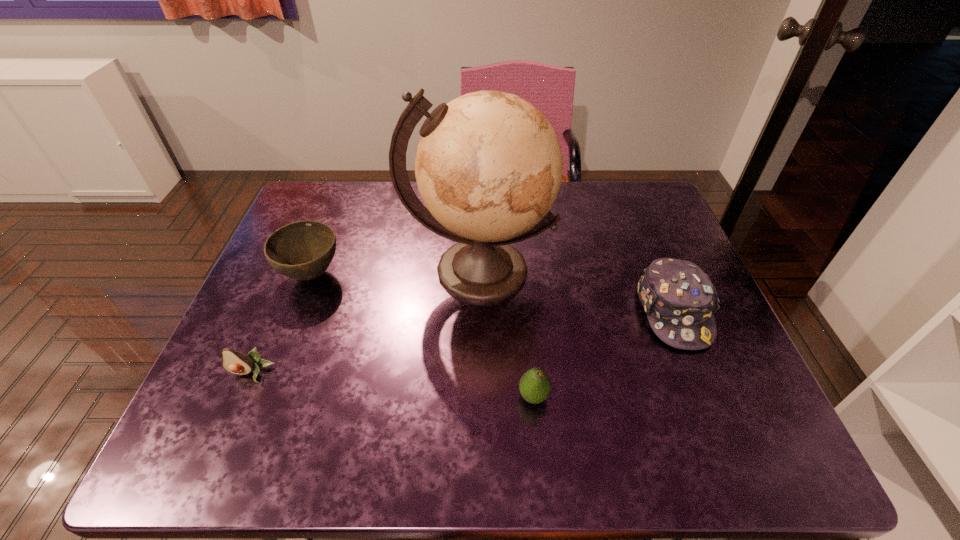
This screenshot has width=960, height=540. I want to click on free space located on the seed side of the left avocado, so click(222, 444).

Identify the location of vacant space located on the right of the right avocado. (696, 396).

Find the location of `bowl located in the left edge section of the desktop`. bowl located in the left edge section of the desktop is located at coordinates (303, 250).

What are the coordinates of `avocado located in the left edge section of the desktop` in the screenshot? It's located at (236, 362).

At what (x,y) coordinates should I click in order to perform the action: click on object at the right edge. Please return your answer as a coordinate pair (x, y). Looking at the image, I should click on (680, 300).

The height and width of the screenshot is (540, 960). In order to click on free space at the far edge of the desktop in this screenshot , I will do `click(559, 196)`.

This screenshot has width=960, height=540. I want to click on vacant space at the near edge, so click(356, 430).

Locate an element on the screen. The width and height of the screenshot is (960, 540). free region at the left edge of the desktop is located at coordinates (252, 327).

Where is `free region at the right edge`? The height and width of the screenshot is (540, 960). free region at the right edge is located at coordinates (628, 249).

Locate an element on the screen. vacant space at the far right corner of the desktop is located at coordinates (650, 181).